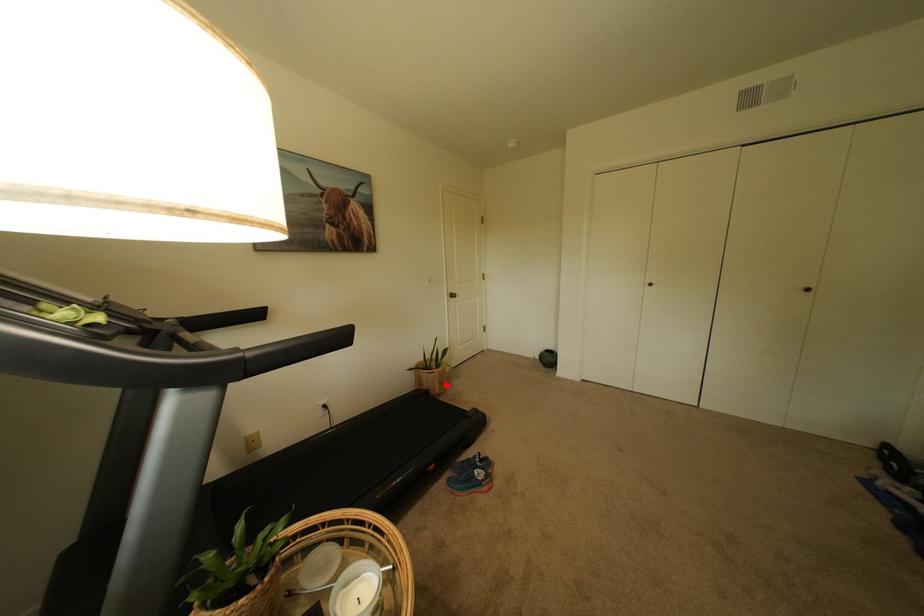
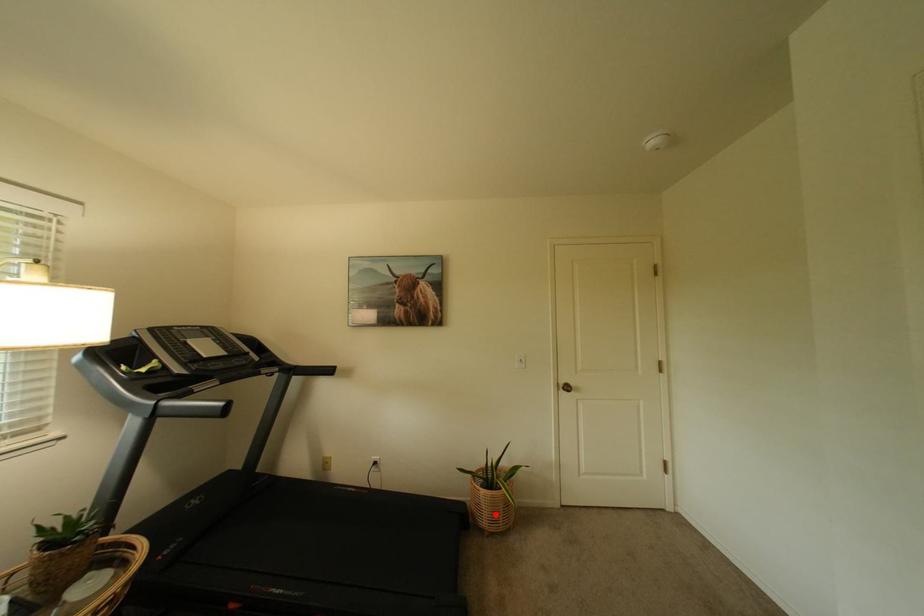
I am providing you with two images of the same scene from different viewpoints. A red point is marked on the first image and another point is marked on the second image. Are the points marked in image1 and image2 representing the same 3D position?

Yes